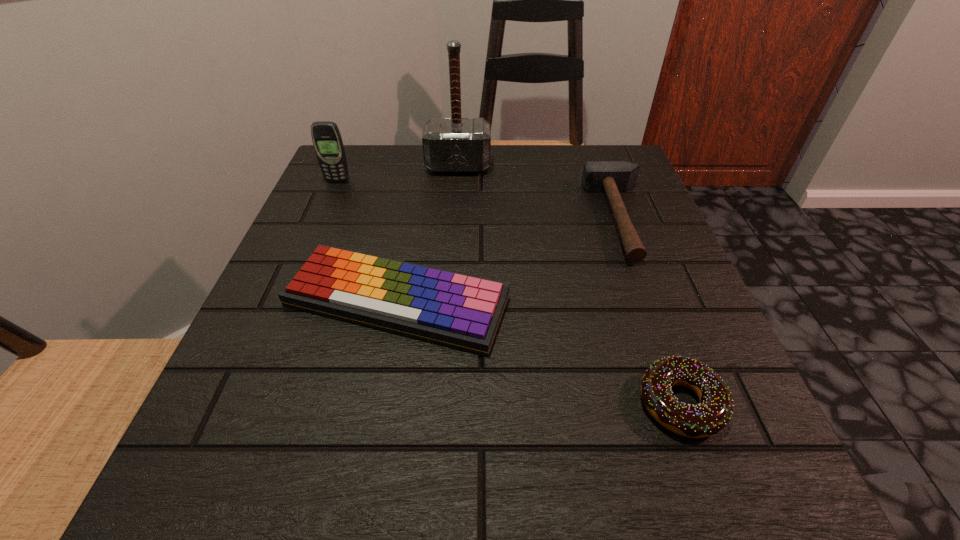
You are a GUI agent. You are given a task and a screenshot of the screen. Output one action in this format:
    pyautogui.click(x=<x>, y=<y>)
    Task: Click on the object that is positioned at the far left corner
    
    Given the screenshot: What is the action you would take?
    pyautogui.click(x=326, y=137)

Where is `object located at the far right corner`? Image resolution: width=960 pixels, height=540 pixels. object located at the far right corner is located at coordinates (612, 177).

Identify the location of object that is at the near right corner. (713, 413).

Locate an element on the screen. This screenshot has width=960, height=540. vacant position at the far edge of the desktop is located at coordinates (508, 163).

Locate an element on the screen. This screenshot has width=960, height=540. free spot at the near edge of the desktop is located at coordinates (509, 505).

Where is `vacant area at the left edge of the desktop`? vacant area at the left edge of the desktop is located at coordinates (286, 280).

You are a GUI agent. You are given a task and a screenshot of the screen. Output one action in this format:
    pyautogui.click(x=<x>, y=<y>)
    Task: Click on the vacant space at the right edge of the desktop
    This screenshot has height=540, width=960.
    Given the screenshot: What is the action you would take?
    pyautogui.click(x=624, y=305)

The image size is (960, 540). In order to click on vacant position at the far left corner of the desktop in this screenshot , I will do `click(379, 186)`.

Locate an element on the screen. This screenshot has height=540, width=960. vacant space at the far right corner of the desktop is located at coordinates (636, 184).

Locate an element on the screen. This screenshot has width=960, height=540. free point between the doughnut and the right hammer is located at coordinates (651, 311).